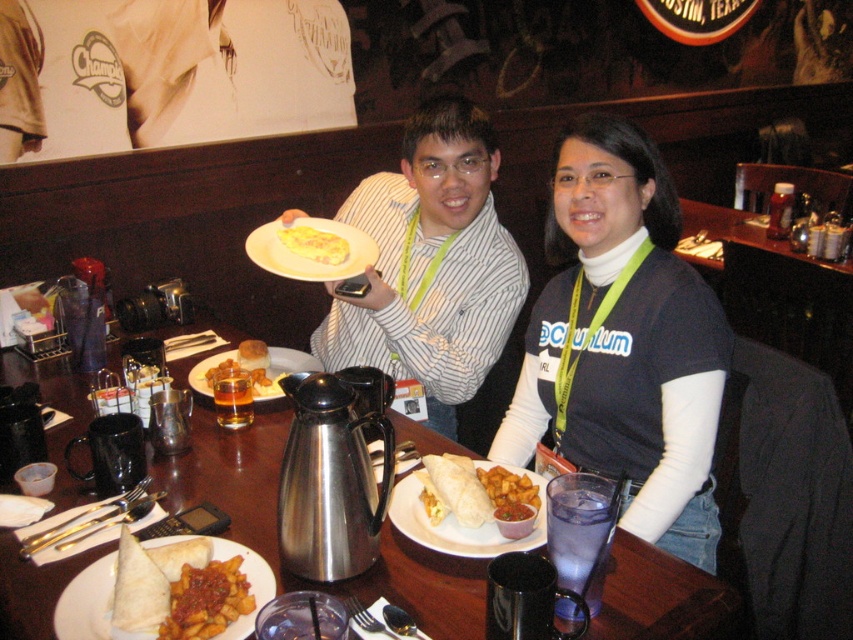
Question: Does golden crispy fries at center have a greater width compared to white matte plate at center?

Choices:
 (A) yes
 (B) no

Answer: (B)

Question: Is matte black shirt at center above translucent glass at center?

Choices:
 (A) yes
 (B) no

Answer: (A)

Question: Which object is farther from the camera taking this photo?

Choices:
 (A) metallic silver thermos at center
 (B) yellow fried chicken at center
 (C) white matte plate at center

Answer: (B)

Question: Which point is closer to the camera taking this photo?

Choices:
 (A) (460, 200)
 (B) (543, 385)

Answer: (B)

Question: In this image, where is matte black shirt at center located relative to yellow fried chicken at center?

Choices:
 (A) above
 (B) below

Answer: (A)

Question: Which object is farther from the camera taking this photo?

Choices:
 (A) matte white plate at center
 (B) soft tortilla wrap at center
 (C) yellow fried chicken at center

Answer: (C)